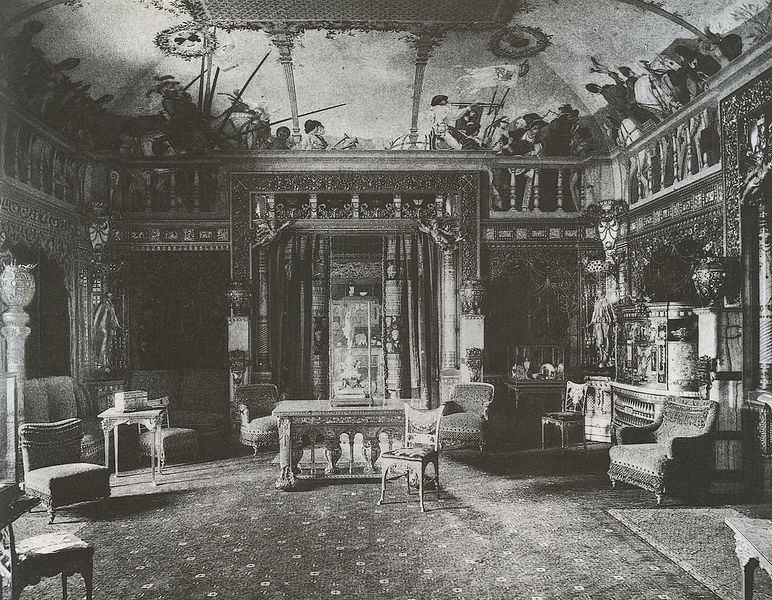
Identify the location of entrance way. The image size is (772, 600). (356, 301).